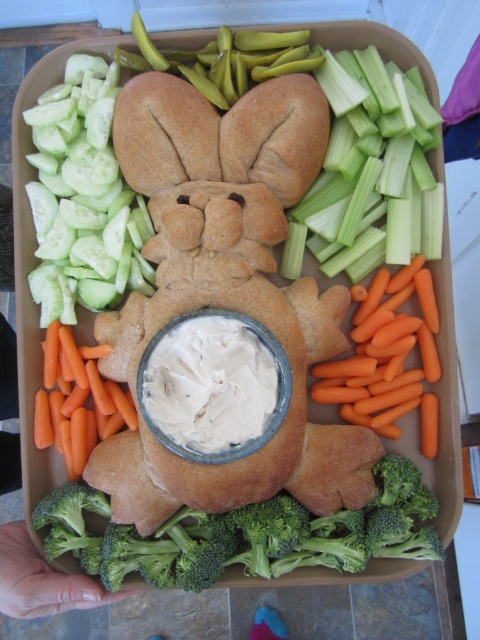
Is bread at center below white creamy dip at center?

No, bread at center is not below white creamy dip at center.

Is bread at center shorter than white creamy dip at center?

In fact, bread at center may be taller than white creamy dip at center.

Which is in front, point (282, 92) or point (240, 452)?

Point (240, 452) is more forward.

Where is `bread at center`? bread at center is located at coordinates (224, 312).

Can you confirm if green broccoli at bottom is positioned to the right of green celery at upper right?

In fact, green broccoli at bottom is to the left of green celery at upper right.

Between point (197, 566) and point (388, 260), which one is positioned in front?

Point (197, 566) is more forward.

Where is `green broccoli at bottom`? This screenshot has height=640, width=480. green broccoli at bottom is located at coordinates (245, 534).

Which of these two, green broccoli at bottom or orange smooth carrot at lower right, stands shorter?

green broccoli at bottom

Who is taller, green broccoli at bottom or orange smooth carrot at lower right?

orange smooth carrot at lower right

What do you see at coordinates (245, 534) in the screenshot? I see `green broccoli at bottom` at bounding box center [245, 534].

You are a GUI agent. You are given a task and a screenshot of the screen. Output one action in this format:
    pyautogui.click(x=<x>, y=<y>)
    Task: Click on the green broccoli at bottom
    This screenshot has width=480, height=640.
    Given the screenshot: What is the action you would take?
    pyautogui.click(x=245, y=534)